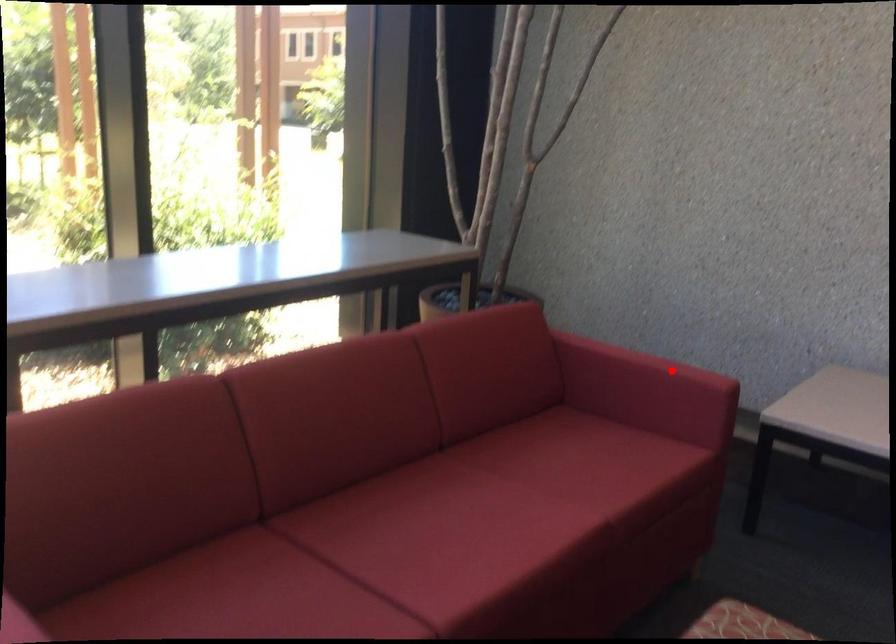
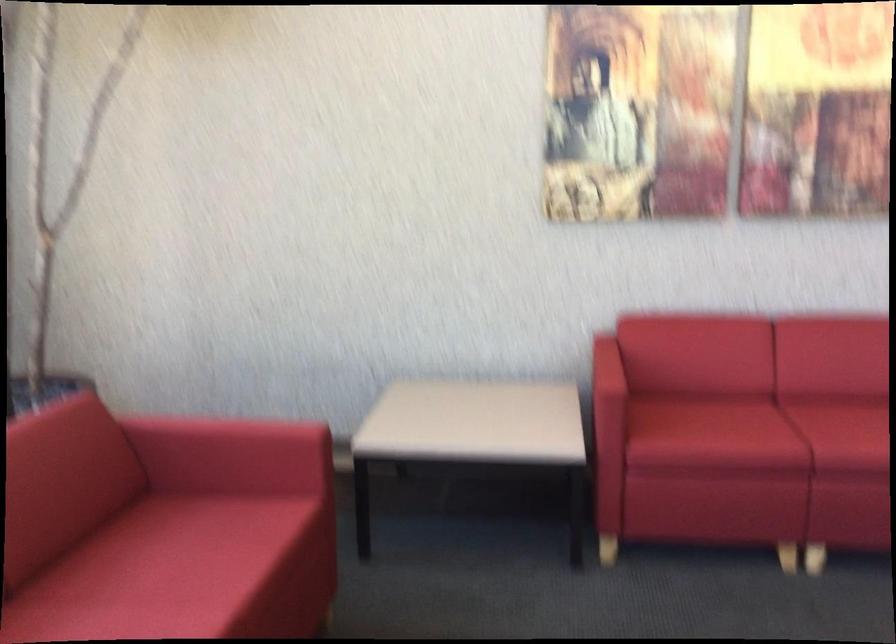
Locate, in the second image, the point that corresponds to the highlighted location in the first image.

(261, 431)